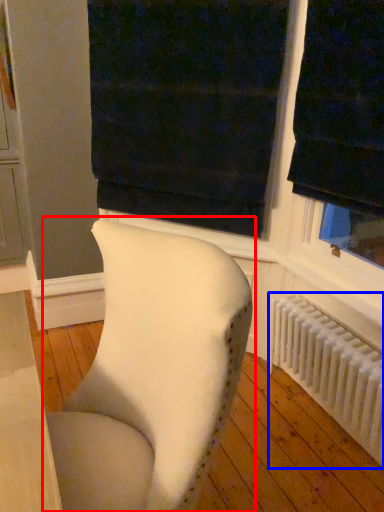
Question: Which point is further to the camera, chair (highlighted by a red box) or radiator (highlighted by a blue box)?

Choices:
 (A) chair
 (B) radiator

Answer: (B)